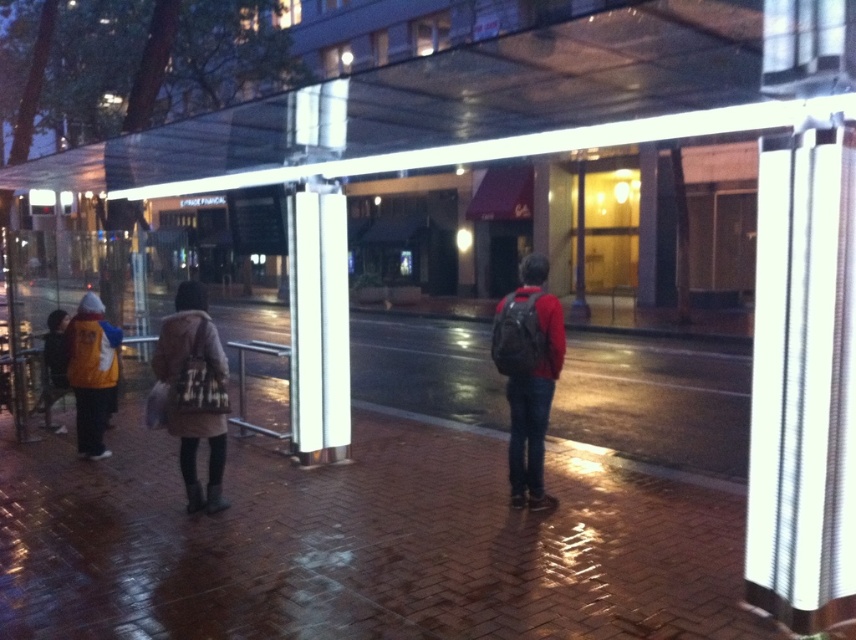
Question: Can you confirm if matte black backpack at center is positioned to the right of matte yellow jacket at left?

Choices:
 (A) yes
 (B) no

Answer: (A)

Question: From the image, what is the correct spatial relationship of brown fuzzy coat at center in relation to matte black backpack at center?

Choices:
 (A) above
 (B) below

Answer: (B)

Question: Among these points, which one is nearest to the camera?

Choices:
 (A) (99, 372)
 (B) (551, 296)
 (C) (56, 372)
 (D) (183, 365)

Answer: (D)

Question: Which of these objects is positioned closest to the brown fuzzy coat at center?

Choices:
 (A) matte yellow jacket at left
 (B) matte black backpack at center

Answer: (A)

Question: Which is nearer to the matte black backpack at center?

Choices:
 (A) brown fuzzy coat at center
 (B) yellow jacket at left

Answer: (A)

Question: Can you confirm if matte black backpack at center is positioned to the left of matte yellow jacket at left?

Choices:
 (A) yes
 (B) no

Answer: (B)